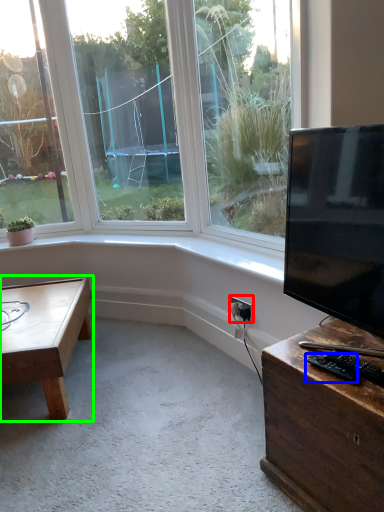
Question: Based on their relative distances, which object is farther from electric outlet (highlighted by a red box)? Choose from wide (highlighted by a blue box) and coffee table (highlighted by a green box).

Choices:
 (A) wide
 (B) coffee table

Answer: (B)